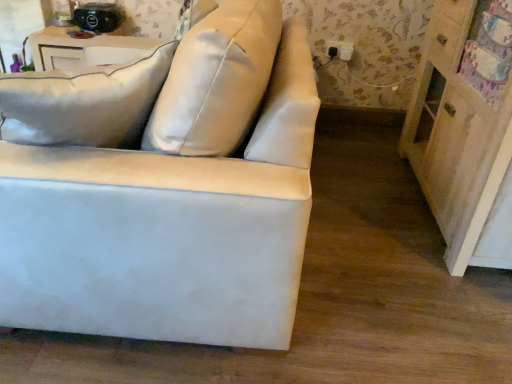
Question: Does white leather couch at center come behind black plastic outlet at upper right?

Choices:
 (A) yes
 (B) no

Answer: (B)

Question: Is white leather couch at center facing away from black plastic outlet at upper right?

Choices:
 (A) yes
 (B) no

Answer: (B)

Question: Are white leather couch at center and black plastic outlet at upper right beside each other?

Choices:
 (A) no
 (B) yes

Answer: (A)

Question: Does white leather couch at center appear on the right side of black plastic outlet at upper right?

Choices:
 (A) yes
 (B) no

Answer: (B)

Question: Is the position of white leather couch at center less distant than that of black plastic outlet at upper right?

Choices:
 (A) yes
 (B) no

Answer: (A)

Question: Is white leather couch at center bigger or smaller than white wood table at upper left?

Choices:
 (A) big
 (B) small

Answer: (A)

Question: Is white leather couch at center taller or shorter than white wood table at upper left?

Choices:
 (A) tall
 (B) short

Answer: (A)

Question: Is white leather couch at center spatially inside white wood table at upper left, or outside of it?

Choices:
 (A) outside
 (B) inside

Answer: (A)

Question: In the image, is white leather couch at center on the left side or the right side of white wood table at upper left?

Choices:
 (A) left
 (B) right

Answer: (B)

Question: From a real-world perspective, is black plastic outlet at upper right positioned above or below white wood table at upper left?

Choices:
 (A) above
 (B) below

Answer: (A)

Question: Is black plastic outlet at upper right taller or shorter than white wood table at upper left?

Choices:
 (A) short
 (B) tall

Answer: (A)

Question: Is black plastic outlet at upper right bigger or smaller than white wood table at upper left?

Choices:
 (A) big
 (B) small

Answer: (B)

Question: Would you say black plastic outlet at upper right is inside or outside white wood table at upper left?

Choices:
 (A) outside
 (B) inside

Answer: (A)

Question: Considering their positions, is white leather couch at center located in front of or behind wooden dresser at right?

Choices:
 (A) behind
 (B) front

Answer: (B)

Question: Considering the positions of white leather couch at center and wooden dresser at right in the image, is white leather couch at center bigger or smaller than wooden dresser at right?

Choices:
 (A) small
 (B) big

Answer: (B)